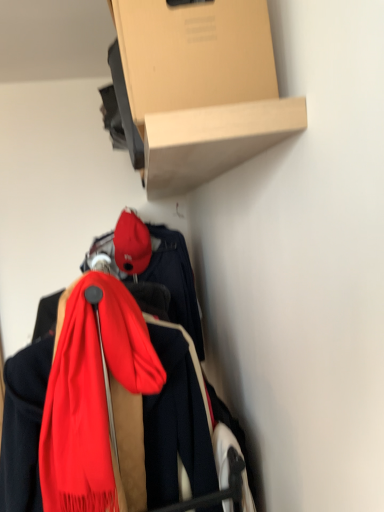
Question: Considering the positions of matte red cap at center and cardboard box at upper center in the image, is matte red cap at center bigger or smaller than cardboard box at upper center?

Choices:
 (A) big
 (B) small

Answer: (B)

Question: Looking at their shapes, would you say matte red cap at center is wider or thinner than cardboard box at upper center?

Choices:
 (A) wide
 (B) thin

Answer: (B)

Question: Based on their relative distances, which object is farther from the silky red scarf at center?

Choices:
 (A) matte red cap at center
 (B) cardboard box at upper center

Answer: (A)

Question: Estimate the real-world distances between objects in this image. Which object is farther from the cardboard box at upper center?

Choices:
 (A) silky red scarf at center
 (B) matte red cap at center

Answer: (B)